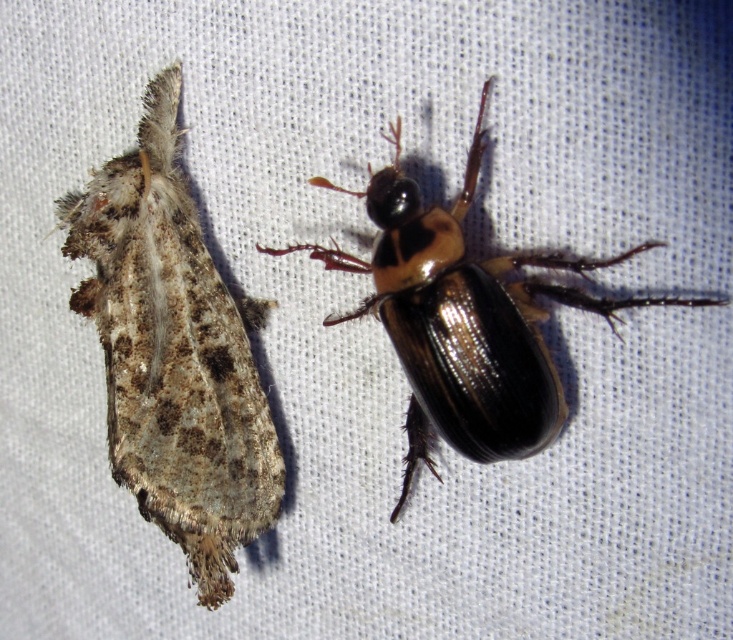
Is fuzzy brown moth at left bigger than shiny black beetle at center?

Actually, fuzzy brown moth at left might be smaller than shiny black beetle at center.

Between point (165, 525) and point (539, 284), which one is positioned in front?

Point (539, 284)

Locate an element on the screen. fuzzy brown moth at left is located at coordinates (174, 353).